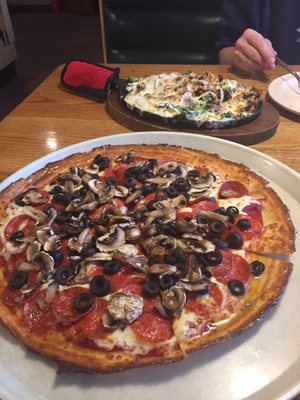
Find the location of a particular element. The width and height of the screenshot is (300, 400). back of the booth is located at coordinates (169, 25), (164, 54), (171, 5).